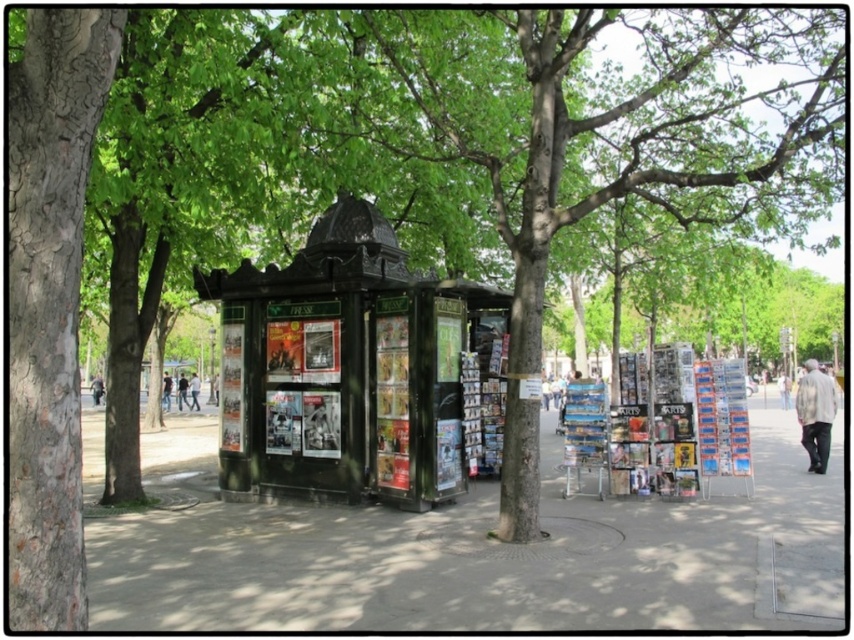
You are standing at the origin point of the coordinate system in the park. The black glossy kiosk at center is at point (344, 368). If you walk directly towards the kiosk, will you pass through the point 0.5, 0.4?

Yes, because the point 0.5, 0.4 lies on the straight path from the origin to the black glossy kiosk at center located at (344, 368). The coordinates are along the same line since the y values are almost the same and the x coordinate increases from 0 to 0.575, so 0.5 is between 0 and 0.575.

What is the 2D coordinate of the smooth concrete sidewalk at center?

The smooth concrete sidewalk at center is located at the 2D coordinate point of (478,554).